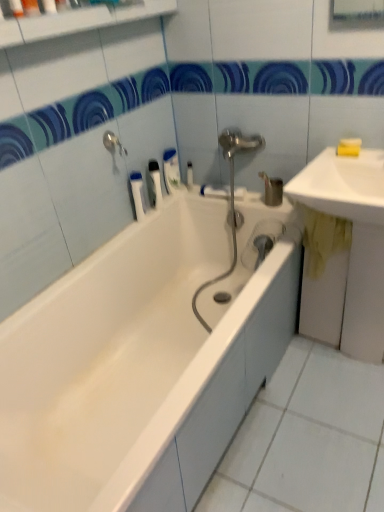
Question: Considering the relative sizes of white glossy sink at upper right, arranged as the 2th sink when ordered from the bottom, and yellow matte soap at upper right, the second soap viewed from the top, in the image provided, is white glossy sink at upper right, arranged as the 2th sink when ordered from the bottom, wider than yellow matte soap at upper right, the second soap viewed from the top,?

Choices:
 (A) no
 (B) yes

Answer: (B)

Question: Is white glossy sink at upper right, the 1th sink in the top-to-bottom sequence, outside of yellow matte soap at upper right, which is counted as the first soap, starting from the bottom?

Choices:
 (A) yes
 (B) no

Answer: (A)

Question: Does white glossy sink at upper right, arranged as the 2th sink when ordered from the bottom, appear on the right side of yellow matte soap at upper right, which is counted as the first soap, starting from the bottom?

Choices:
 (A) yes
 (B) no

Answer: (B)

Question: Considering the relative positions of white glossy sink at upper right, the 1th sink in the top-to-bottom sequence, and yellow matte soap at upper right, which is counted as the first soap, starting from the bottom, in the image provided, is white glossy sink at upper right, the 1th sink in the top-to-bottom sequence, in front of yellow matte soap at upper right, which is counted as the first soap, starting from the bottom,?

Choices:
 (A) yes
 (B) no

Answer: (A)

Question: Does white glossy sink at upper right, arranged as the 2th sink when ordered from the bottom, appear on the left side of yellow matte soap at upper right, which is counted as the first soap, starting from the bottom?

Choices:
 (A) yes
 (B) no

Answer: (A)

Question: From a real-world perspective, relative to white plastic tube at upper center, which ranks as the 2th toiletry in front-to-back order, is white plastic bottle at upper center, which is the 1th toiletry from right to left, vertically above or below?

Choices:
 (A) below
 (B) above

Answer: (A)

Question: Relative to white plastic tube at upper center, arranged as the first toiletry when ordered from the bottom, is white plastic bottle at upper center, which ranks as the third toiletry in bottom-to-top order, in front or behind?

Choices:
 (A) front
 (B) behind

Answer: (B)

Question: Is white plastic bottle at upper center, which ranks as the 1th toiletry in back-to-front order, wider or thinner than white plastic tube at upper center, the 4th toiletry in the top-to-bottom sequence?

Choices:
 (A) wide
 (B) thin

Answer: (B)

Question: In terms of size, does white plastic bottle at upper center, which ranks as the 1th toiletry in back-to-front order, appear bigger or smaller than white plastic tube at upper center, arranged as the first toiletry when ordered from the bottom?

Choices:
 (A) big
 (B) small

Answer: (B)

Question: Looking at the image, does white plastic bottle at upper center, which ranks as the third toiletry in bottom-to-top order, seem bigger or smaller compared to yellow fabric at right, the second sink positioned from the top?

Choices:
 (A) small
 (B) big

Answer: (A)

Question: Is white plastic bottle at upper center, marked as the 2th toiletry in a top-to-bottom arrangement, spatially inside yellow fabric at right, acting as the first sink starting from the bottom, or outside of it?

Choices:
 (A) outside
 (B) inside

Answer: (A)

Question: In terms of width, does white plastic bottle at upper center, which ranks as the third toiletry in bottom-to-top order, look wider or thinner when compared to yellow fabric at right, acting as the first sink starting from the bottom?

Choices:
 (A) wide
 (B) thin

Answer: (B)

Question: From the image's perspective, relative to yellow fabric at right, acting as the first sink starting from the bottom, is white plastic bottle at upper center, the 4th toiletry when ordered from left to right, above or below?

Choices:
 (A) below
 (B) above

Answer: (B)

Question: Looking at the image, does white glossy bathtub at center seem bigger or smaller compared to white glossy sink at upper right, the 1th sink in the top-to-bottom sequence?

Choices:
 (A) small
 (B) big

Answer: (B)

Question: From a real-world perspective, is white glossy bathtub at center above or below white glossy sink at upper right, the 1th sink in the top-to-bottom sequence?

Choices:
 (A) below
 (B) above

Answer: (A)